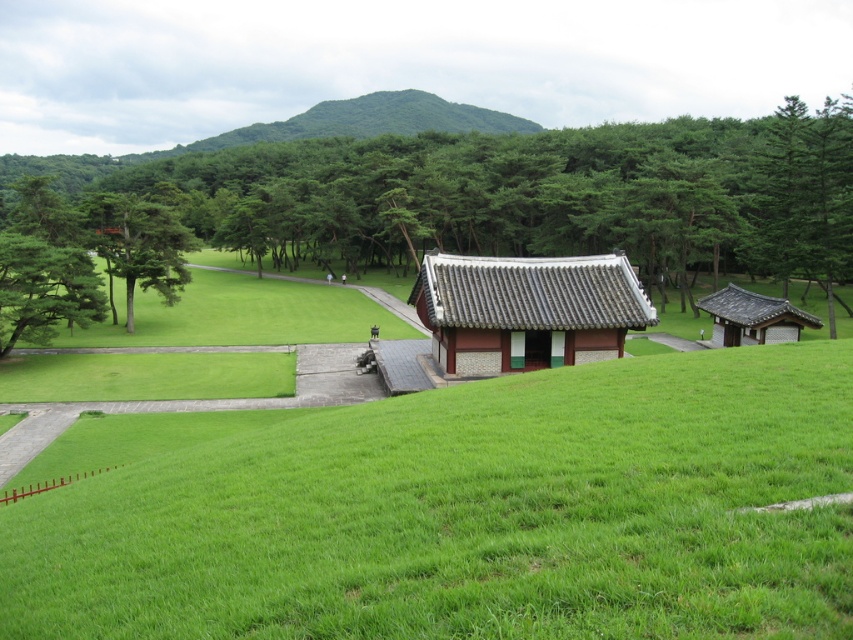
Question: Can you confirm if green leafy tree at center is positioned to the right of green leafy tree at left?

Choices:
 (A) yes
 (B) no

Answer: (A)

Question: Which object appears closest to the camera in this image?

Choices:
 (A) green textured tree at upper right
 (B) green leafy tree at left
 (C) matte gray tile hut at center

Answer: (C)

Question: Which object is the closest to the matte gray tile hut at center?

Choices:
 (A) green leafy tree at left
 (B) brown wooden hut at lower right
 (C) green textured tree at upper right

Answer: (B)

Question: Does green leafy tree at center appear over matte gray tile hut at center?

Choices:
 (A) no
 (B) yes

Answer: (B)

Question: Estimate the real-world distances between objects in this image. Which object is closer to the green grass at center?

Choices:
 (A) green leafy tree at left
 (B) matte gray tile hut at center
 (C) green textured tree at upper left

Answer: (B)

Question: Is green grass at center bigger than green leafy tree at center?

Choices:
 (A) yes
 (B) no

Answer: (B)